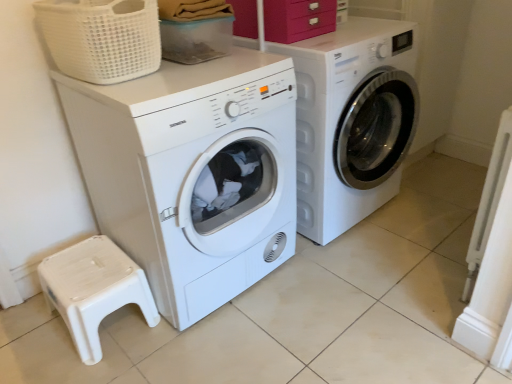
The width and height of the screenshot is (512, 384). I want to click on empty space that is to the right of white glossy washing machine at center, marked as the 2th washing machine in a left-to-right arrangement, so click(x=433, y=202).